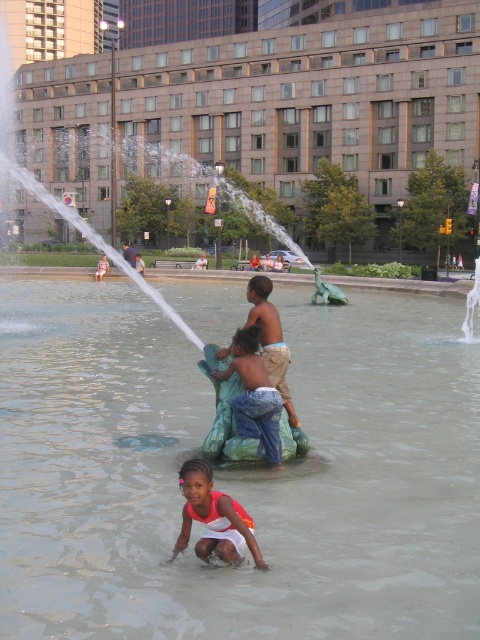
Is clear water at center to the right of tan cotton shorts at center from the viewer's perspective?

Indeed, clear water at center is positioned on the right side of tan cotton shorts at center.

Is point (63, 396) more distant than point (280, 376)?

Yes, it is.

The width and height of the screenshot is (480, 640). What do you see at coordinates (236, 474) in the screenshot?
I see `clear water at center` at bounding box center [236, 474].

What are the coordinates of `clear water at center` in the screenshot? It's located at (236, 474).

Is tan cotton shorts at center below smooth skin child at center?

Yes, tan cotton shorts at center is below smooth skin child at center.

Which of these two, tan cotton shorts at center or smooth skin child at center, stands taller?

tan cotton shorts at center is taller.

In order to click on tan cotton shorts at center in this screenshot , I will do `click(271, 339)`.

Is blue-green stone statue at center behind smooth skin child at center?

No, it is in front of smooth skin child at center.

The width and height of the screenshot is (480, 640). What are the coordinates of `blue-green stone statue at center` in the screenshot? It's located at (253, 396).